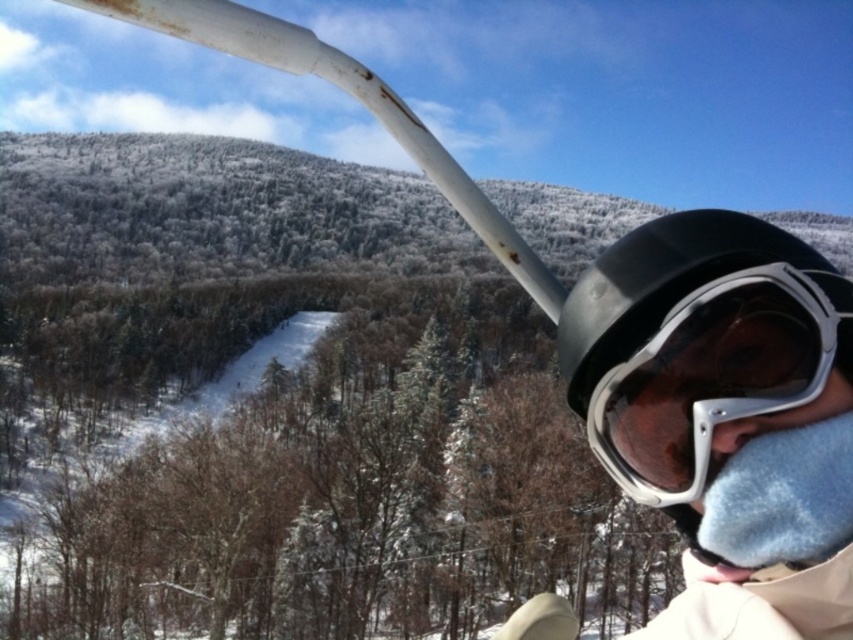
Question: Can you confirm if matte black goggles at right is positioned to the left of matte white nose at lower center?

Choices:
 (A) yes
 (B) no

Answer: (A)

Question: Which of the following is the farthest from the observer?

Choices:
 (A) matte white nose at lower center
 (B) matte black goggles at right

Answer: (A)

Question: Which object is farther from the camera taking this photo?

Choices:
 (A) matte black goggles at right
 (B) matte white nose at lower center

Answer: (B)

Question: Is matte black goggles at right wider than matte white nose at lower center?

Choices:
 (A) yes
 (B) no

Answer: (A)

Question: Does matte black goggles at right appear over matte white nose at lower center?

Choices:
 (A) no
 (B) yes

Answer: (B)